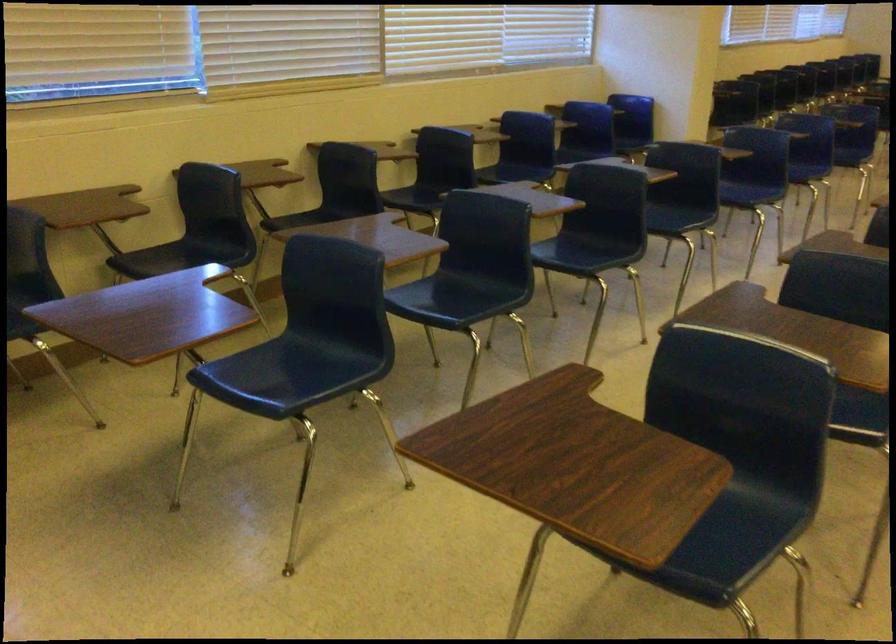
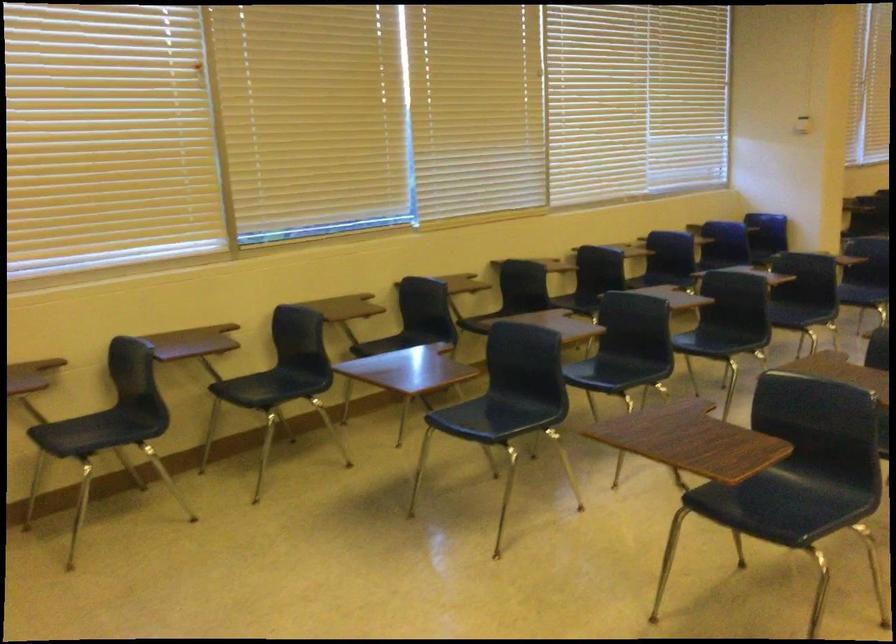
Question: The first image is from the beginning of the video and the second image is from the end. How did the camera likely rotate when shooting the video?

Choices:
 (A) Left
 (B) Right
 (C) Up
 (D) Down

Answer: (A)